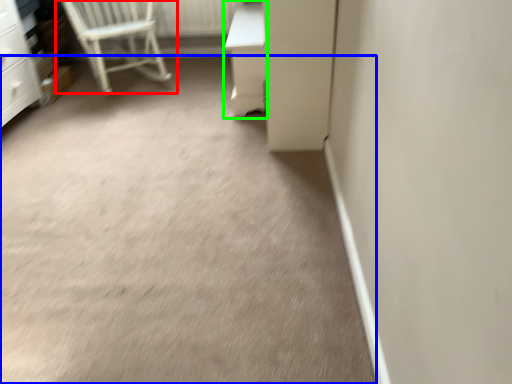
Question: Considering the real-world distances, which object is closest to chair (highlighted by a red box)? concrete (highlighted by a blue box) or vanity (highlighted by a green box).

Choices:
 (A) concrete
 (B) vanity

Answer: (B)